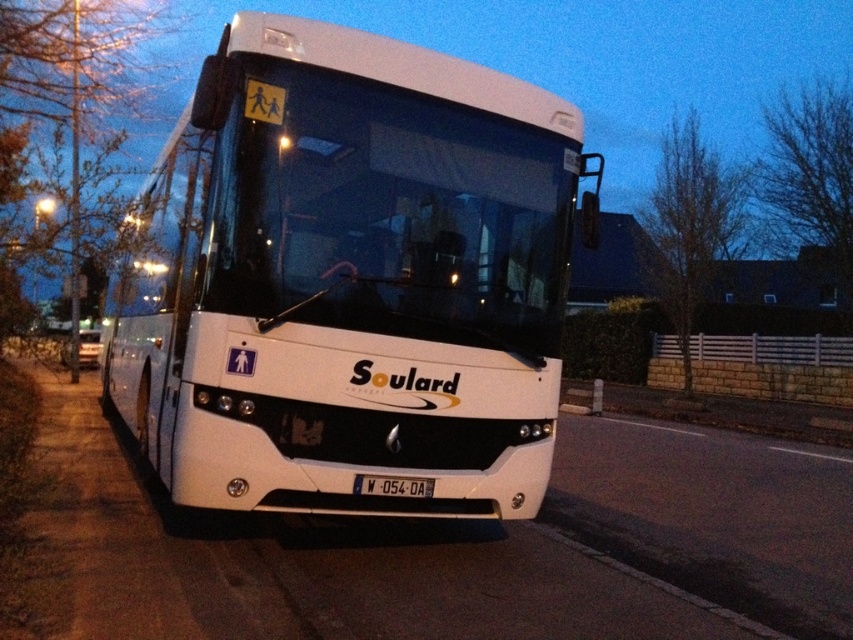
Question: Which of the following is the closest to the observer?

Choices:
 (A) (405, 493)
 (B) (564, 188)

Answer: (A)

Question: In this image, where is white matte bus at center located relative to black plastic license plate at center?

Choices:
 (A) left
 (B) right

Answer: (A)

Question: Which point is closer to the camera taking this photo?

Choices:
 (A) (364, 490)
 (B) (213, 76)

Answer: (B)

Question: Is white matte bus at center positioned in front of black plastic license plate at center?

Choices:
 (A) yes
 (B) no

Answer: (A)

Question: Which point is farther to the camera?

Choices:
 (A) 505,176
 (B) 363,484

Answer: (A)

Question: Does white matte bus at center have a lesser width compared to black plastic license plate at center?

Choices:
 (A) no
 (B) yes

Answer: (B)